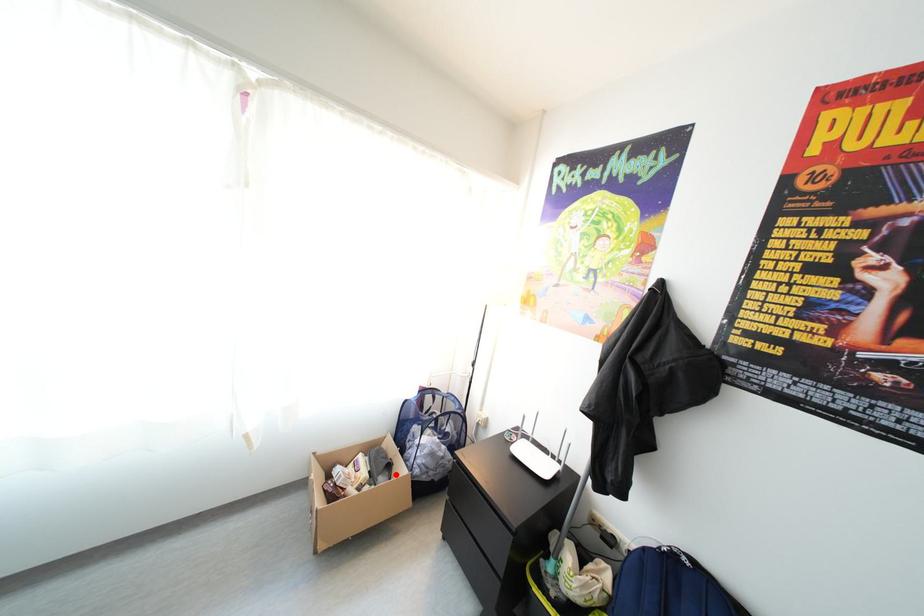
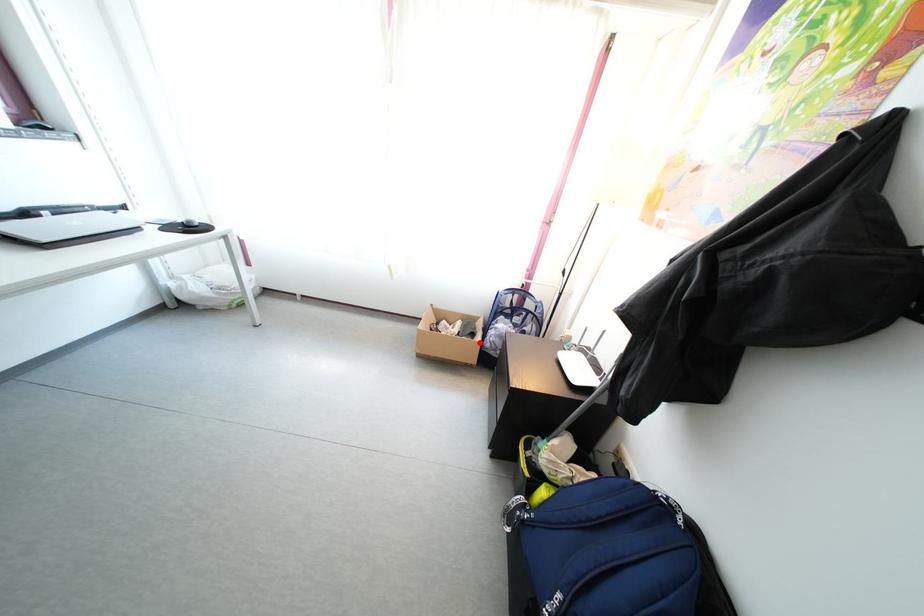
I am providing you with two images of the same scene from different viewpoints. A red point is marked on the first image and another point is marked on the second image. Does the point marked in image1 correspond to the same location as the one in image2?

Yes